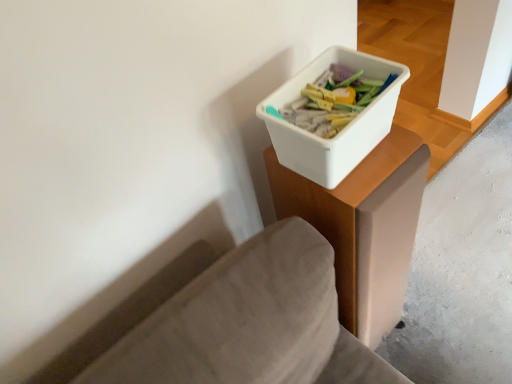
Where is `white plastic container at upper right`? white plastic container at upper right is located at coordinates (364, 227).

From the image's perspective, is white plastic container at upper right located beneath smooth concrete at lower right?

No, from the image's perspective, white plastic container at upper right is not below smooth concrete at lower right.

Is white plastic container at upper right wider or thinner than smooth concrete at lower right?

Considering their sizes, white plastic container at upper right looks slimmer than smooth concrete at lower right.

How distant is white plastic container at upper right from smooth concrete at lower right?

1.01 meters.

Considering the positions of point (364, 129) and point (438, 221), is point (364, 129) closer or farther from the camera than point (438, 221)?

Point (364, 129).

Considering the points (371, 142) and (412, 247), which point is in front, point (371, 142) or point (412, 247)?

Positioned in front is point (371, 142).

Considering the positions of objects white plastic container at upper right and white plastic container at upper right in the image provided, who is behind, white plastic container at upper right or white plastic container at upper right?

white plastic container at upper right.

Choose the correct answer: Is white plastic container at upper right inside white plastic container at upper right or outside it?

white plastic container at upper right exists outside the volume of white plastic container at upper right.

Is white plastic container at upper right in contact with white plastic container at upper right?

No, white plastic container at upper right is not making contact with white plastic container at upper right.

Is white plastic container at upper right located outside smooth concrete at lower right?

Indeed, white plastic container at upper right is completely outside smooth concrete at lower right.

Can you confirm if white plastic container at upper right is shorter than smooth concrete at lower right?

No, white plastic container at upper right is not shorter than smooth concrete at lower right.

From a real-world perspective, between white plastic container at upper right and smooth concrete at lower right, who is vertically higher?

white plastic container at upper right.

Locate an element on the screen. The image size is (512, 384). table that appears on the left of smooth concrete at lower right is located at coordinates (364, 227).

Does smooth concrete at lower right have a greater height compared to white plastic container at upper right?

In fact, smooth concrete at lower right may be shorter than white plastic container at upper right.

Considering the relative sizes of smooth concrete at lower right and white plastic container at upper right in the image provided, is smooth concrete at lower right bigger than white plastic container at upper right?

Incorrect, smooth concrete at lower right is not larger than white plastic container at upper right.

From the image's perspective, between smooth concrete at lower right and white plastic container at upper right, which one is located above?

From the image's view, smooth concrete at lower right is above.

Are white plastic container at upper right and white plastic container at upper right located far from each other?

They are positioned close to each other.

Considering the sizes of objects white plastic container at upper right and white plastic container at upper right in the image provided, who is thinner, white plastic container at upper right or white plastic container at upper right?

white plastic container at upper right.

Is the position of white plastic container at upper right more distant than that of white plastic container at upper right?

Yes, white plastic container at upper right is behind white plastic container at upper right.

Looking at the image, does white plastic container at upper right seem bigger or smaller compared to white plastic container at upper right?

Considering their sizes, white plastic container at upper right takes up more space than white plastic container at upper right.

Can you confirm if smooth concrete at lower right is bigger than white plastic container at upper right?

Yes.

Considering the sizes of objects smooth concrete at lower right and white plastic container at upper right in the image provided, who is wider, smooth concrete at lower right or white plastic container at upper right?

smooth concrete at lower right.

From a real-world perspective, is smooth concrete at lower right on top of white plastic container at upper right?

No, from a real-world perspective, smooth concrete at lower right is not above white plastic container at upper right.

From the image's perspective, is smooth concrete at lower right located above or below white plastic container at upper right?

Based on their image positions, smooth concrete at lower right is located beneath white plastic container at upper right.

Locate an element on the screen. This screenshot has height=384, width=512. concrete below the white plastic container at upper right (from a real-world perspective) is located at coordinates (462, 269).

Where is `storage box located above the white plastic container at upper right (from the image's perspective)`? storage box located above the white plastic container at upper right (from the image's perspective) is located at coordinates (344, 128).

Estimate the real-world distances between objects in this image. Which object is closer to white plastic container at upper right, white plastic container at upper right or smooth concrete at lower right?

white plastic container at upper right is closer to white plastic container at upper right.

From the image, which object appears to be nearer to white plastic container at upper right, smooth concrete at lower right or white plastic container at upper right?

white plastic container at upper right is positioned closer to the anchor white plastic container at upper right.

Which object lies nearer to the anchor point white plastic container at upper right, smooth concrete at lower right or white plastic container at upper right?

white plastic container at upper right is closer to white plastic container at upper right.

Which object lies nearer to the anchor point smooth concrete at lower right, white plastic container at upper right or white plastic container at upper right?

white plastic container at upper right is positioned closer to the anchor smooth concrete at lower right.

Considering their positions, is white plastic container at upper right positioned closer to white plastic container at upper right than smooth concrete at lower right?

Based on the image, white plastic container at upper right appears to be nearer to white plastic container at upper right.

From the picture: Considering their positions, is white plastic container at upper right positioned closer to smooth concrete at lower right than white plastic container at upper right?

Based on the image, white plastic container at upper right appears to be nearer to smooth concrete at lower right.

Locate an element on the screen. This screenshot has height=384, width=512. table situated between white plastic container at upper right and smooth concrete at lower right from left to right is located at coordinates (364, 227).